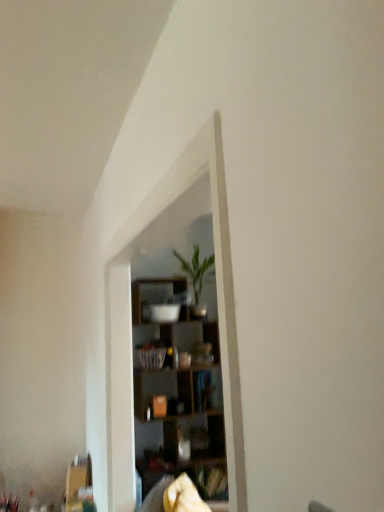
Find the location of a particular element. The height and width of the screenshot is (512, 384). green leafy plant at center is located at coordinates (195, 269).

Describe the element at coordinates (195, 269) in the screenshot. This screenshot has width=384, height=512. I see `green leafy plant at center` at that location.

In order to face green leafy plant at center, should I rotate leftwards or rightwards?

Rotate your view right by about 0.847°.

The height and width of the screenshot is (512, 384). Identify the location of wooden shelves at center. click(178, 393).

What do you see at coordinates (178, 393) in the screenshot? This screenshot has width=384, height=512. I see `wooden shelves at center` at bounding box center [178, 393].

I want to click on green leafy plant at center, so click(x=195, y=269).

Which object is positioned more to the right, green leafy plant at center or wooden shelves at center?

green leafy plant at center is more to the right.

Who is more distant, green leafy plant at center or wooden shelves at center?

green leafy plant at center.

Is point (192, 281) positioned in front of point (174, 410)?

No, it is behind (174, 410).

From the image's perspective, is green leafy plant at center positioned above or below wooden shelves at center?

Based on their image positions, green leafy plant at center is located above wooden shelves at center.

From a real-world perspective, is green leafy plant at center over wooden shelves at center?

Yes, from a real-world perspective, green leafy plant at center is over wooden shelves at center

Between green leafy plant at center and wooden shelves at center, which one has smaller width?

green leafy plant at center.

Considering the relative sizes of green leafy plant at center and wooden shelves at center in the image provided, is green leafy plant at center shorter than wooden shelves at center?

Indeed, green leafy plant at center has a lesser height compared to wooden shelves at center.

Which of these two, green leafy plant at center or wooden shelves at center, is smaller?

green leafy plant at center is smaller.

Do you think green leafy plant at center is within wooden shelves at center, or outside of it?

green leafy plant at center can be found inside wooden shelves at center.

Are green leafy plant at center and wooden shelves at center located far from each other?

green leafy plant at center is near wooden shelves at center, not far away.

Is green leafy plant at center facing away from wooden shelves at center?

Yes.

What's the angular difference between green leafy plant at center and wooden shelves at center's facing directions?

They differ by 1.91 degrees in their facing directions.

I want to click on houseplant behind the wooden shelves at center, so click(x=195, y=269).

Which object is positioned more to the left, wooden shelves at center or green leafy plant at center?

wooden shelves at center.

Relative to green leafy plant at center, is wooden shelves at center in front or behind?

Clearly, wooden shelves at center is in front of green leafy plant at center.

Considering the positions of point (185, 342) and point (196, 250), is point (185, 342) closer or farther from the camera than point (196, 250)?

Point (185, 342) is closer to the camera than point (196, 250).

From the image's perspective, which one is positioned lower, wooden shelves at center or green leafy plant at center?

wooden shelves at center appears lower in the image.

From a real-world perspective, is wooden shelves at center over green leafy plant at center?

Actually, wooden shelves at center is physically below green leafy plant at center in the real world.

In terms of width, does wooden shelves at center look wider or thinner when compared to green leafy plant at center?

wooden shelves at center is wider than green leafy plant at center.

Considering the relative sizes of wooden shelves at center and green leafy plant at center in the image provided, is wooden shelves at center taller than green leafy plant at center?

Yes, wooden shelves at center is taller than green leafy plant at center.

Who is bigger, wooden shelves at center or green leafy plant at center?

Bigger between the two is wooden shelves at center.

Is wooden shelves at center outside of green leafy plant at center?

That's correct, wooden shelves at center is outside of green leafy plant at center.

Would you consider wooden shelves at center to be distant from green leafy plant at center?

Actually, wooden shelves at center and green leafy plant at center are a little close together.

Is wooden shelves at center positioned with its back to green leafy plant at center?

No.

Where is `shelf beneath the green leafy plant at center (from a real-world perspective)`? shelf beneath the green leafy plant at center (from a real-world perspective) is located at coordinates (178, 393).

Locate an element on the screen. The image size is (384, 512). shelf below the green leafy plant at center (from the image's perspective) is located at coordinates (178, 393).

Where is `shelf below the green leafy plant at center (from a real-world perspective)`? This screenshot has height=512, width=384. shelf below the green leafy plant at center (from a real-world perspective) is located at coordinates (178, 393).